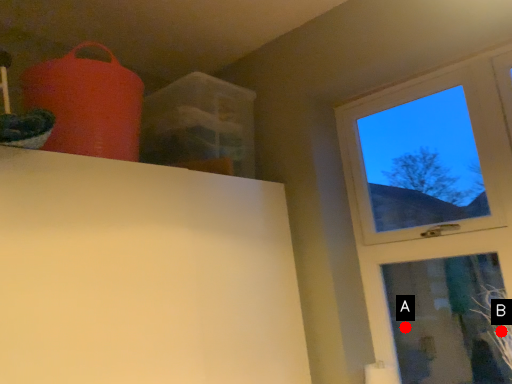
Question: Two points are circled on the image, labeled by A and B beside each circle. Which point is closer to the camera?

Choices:
 (A) A is closer
 (B) B is closer

Answer: (B)